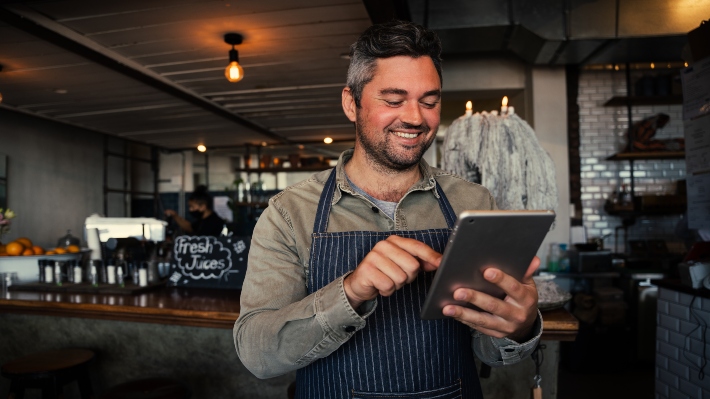
This screenshot has height=399, width=710. Identify the location of white wall. (547, 87), (476, 77), (65, 187).